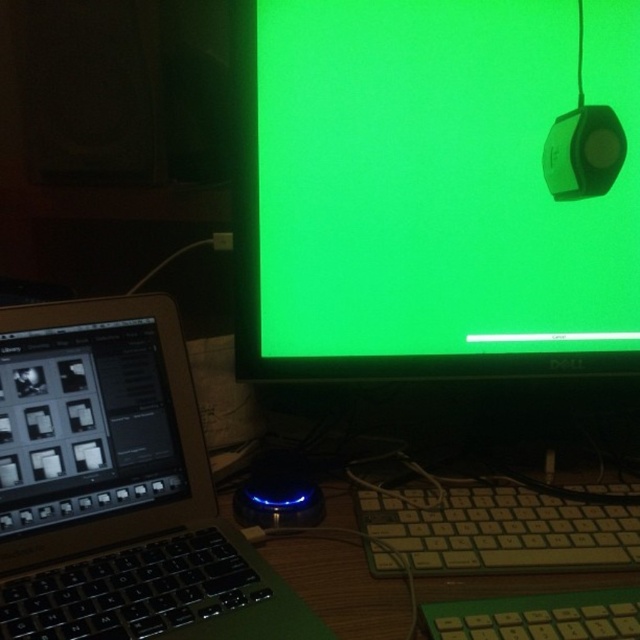
Question: Estimate the real-world distances between objects in this image. Which object is farther from the black matte screen at lower left?

Choices:
 (A) white plastic keyboard at lower center
 (B) satin black laptop at left
 (C) blue led mouse at center
 (D) green matte monitor at upper center

Answer: (A)

Question: Is white plastic keyboard at lower center wider than blue led mouse at center?

Choices:
 (A) no
 (B) yes

Answer: (B)

Question: Which object appears farthest from the camera in this image?

Choices:
 (A) black matte screen at lower left
 (B) white plastic keyboard at lower center
 (C) green matte monitor at upper center

Answer: (C)

Question: Which object appears farthest from the camera in this image?

Choices:
 (A) blue led mouse at center
 (B) black matte screen at lower left
 (C) green matte monitor at upper center

Answer: (A)

Question: Does satin black laptop at left appear on the right side of white plastic keyboard at lower center?

Choices:
 (A) no
 (B) yes

Answer: (A)

Question: Can you confirm if green matte monitor at upper center is wider than black matte screen at lower left?

Choices:
 (A) yes
 (B) no

Answer: (A)